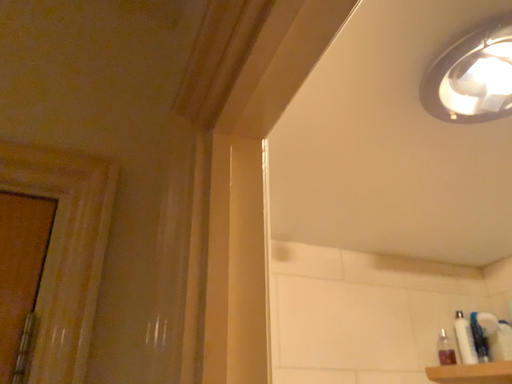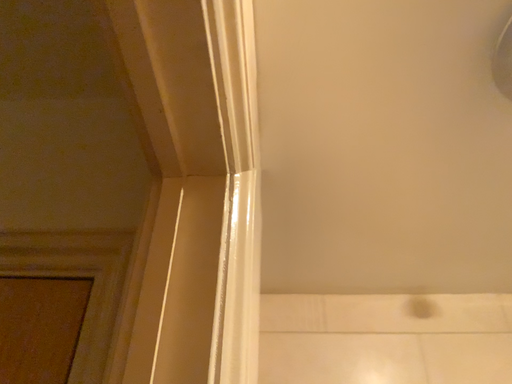
Question: How did the camera likely rotate when shooting the video?

Choices:
 (A) rotated left
 (B) rotated right

Answer: (A)